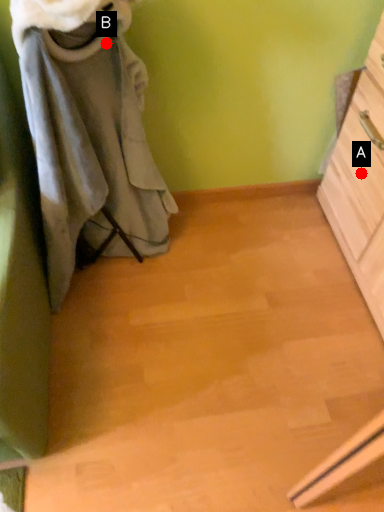
Question: Two points are circled on the image, labeled by A and B beside each circle. Which point is farther from the camera taking this photo?

Choices:
 (A) A is further
 (B) B is further

Answer: (A)